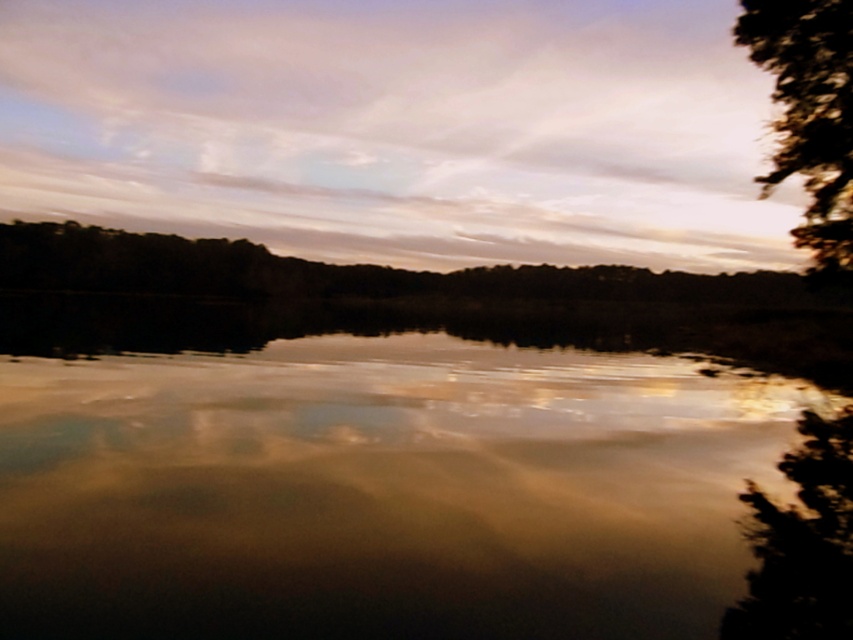
You are standing at the lakeside and want to take a photo of the cloudy sky at upper center and the dark green textured tree at right. Which object will appear larger in the photo?

The cloudy sky at upper center is taller than the dark green textured tree at right, so it will appear larger in the photo.

You are a photographer standing at the edge of the lake. You want to take a photo that includes both point (308, 531) and point (184, 8). Which point will appear larger in the photo?

Point (308, 531) is closer to the camera than point (184, 8), so it will appear larger in the photo.

You are an artist planning to paint this lakeside scene. You want to ensure the brown reflective water at center and the cloudy sky at upper center are proportionally accurate. Which object should you paint to be wider in your artwork?

The cloudy sky at upper center should be painted wider since the brown reflective water at center has a lesser width compared to cloudy sky at upper center according to the description.